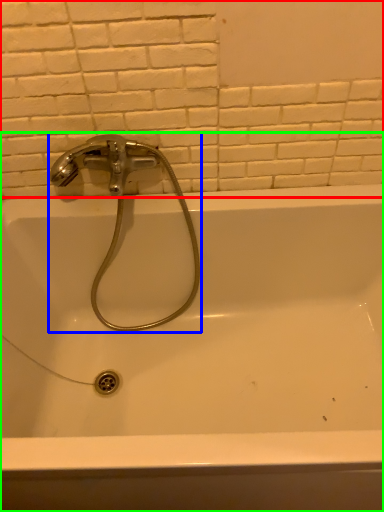
Question: Which object is positioned farthest from ceramic tile (highlighted by a red box)? Select from tap (highlighted by a blue box) and bathtub (highlighted by a green box).

Choices:
 (A) tap
 (B) bathtub

Answer: (B)